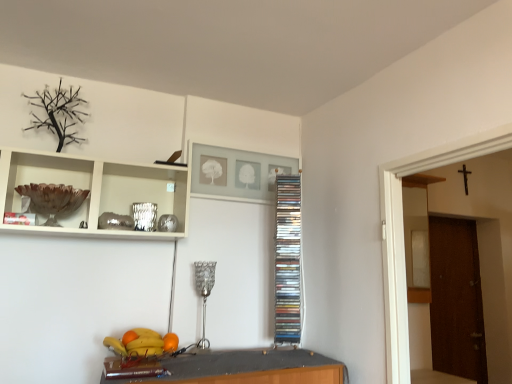
The width and height of the screenshot is (512, 384). I want to click on orange matte at lower center, the first orange positioned from the right, so click(x=170, y=342).

Identify the location of clear plastic cd rack at center, marked as the second cabinet in a left-to-right arrangement. (288, 260).

Where is `silver metallic lamp at center`? The height and width of the screenshot is (384, 512). silver metallic lamp at center is located at coordinates (204, 292).

Does point (446, 365) lie behind point (205, 297)?

Yes, it is.

From the image's perspective, which is above, brown textured door at right or silver metallic lamp at center?

silver metallic lamp at center, from the image's perspective.

Is brown textured door at right facing away from silver metallic lamp at center?

No, silver metallic lamp at center is not at the back of brown textured door at right.

Is clear plastic cd rack at center, which is the first cabinet from back to front, placed right next to brown textured door at right?

No.

From a real-world perspective, who is located lower, clear plastic cd rack at center, which is the first cabinet from back to front, or brown textured door at right?

brown textured door at right is physically lower.

From the image's perspective, which one is positioned higher, clear plastic cd rack at center, marked as the second cabinet in a left-to-right arrangement, or brown textured door at right?

From the image's view, clear plastic cd rack at center, marked as the second cabinet in a left-to-right arrangement, is above.

Considering the relative sizes of orange matte at lower center, marked as the first orange in a left-to-right arrangement, and orange matte at lower center, the second orange in the left-to-right sequence, in the image provided, is orange matte at lower center, marked as the first orange in a left-to-right arrangement, taller than orange matte at lower center, the second orange in the left-to-right sequence,?

Incorrect, the height of orange matte at lower center, marked as the first orange in a left-to-right arrangement, is not larger of that of orange matte at lower center, the second orange in the left-to-right sequence.

Identify the location of orange behind the orange matte at lower center, marked as the first orange in a left-to-right arrangement. (170, 342).

Is orange matte at lower center, marked as the first orange in a left-to-right arrangement, next to orange matte at lower center, the second orange in the left-to-right sequence, and touching it?

orange matte at lower center, marked as the first orange in a left-to-right arrangement, and orange matte at lower center, the second orange in the left-to-right sequence, are clearly separated.

From the picture: From the image's perspective, is orange matte at lower center, arranged as the 2th orange when viewed from the right, located above orange matte at lower center, the first orange positioned from the right?

Yes, from the image's perspective, orange matte at lower center, arranged as the 2th orange when viewed from the right, is on top of orange matte at lower center, the first orange positioned from the right.

Is clear plastic cd rack at center, which is the first cabinet from back to front, at the back of shiny plastic bowl at lower center?

No.

In the image, is shiny plastic bowl at lower center on the left side or the right side of clear plastic cd rack at center, marked as the second cabinet in a left-to-right arrangement?

Clearly, shiny plastic bowl at lower center is on the left of clear plastic cd rack at center, marked as the second cabinet in a left-to-right arrangement, in the image.

Measure the distance between shiny plastic bowl at lower center and clear plastic cd rack at center, positioned as the 2th cabinet in front-to-back order.

shiny plastic bowl at lower center and clear plastic cd rack at center, positioned as the 2th cabinet in front-to-back order, are 71.64 centimeters apart.

Locate an element on the screen. This screenshot has width=512, height=384. door located behind the orange matte at lower center, arranged as the 2th orange when viewed from the right is located at coordinates (456, 300).

Can you confirm if orange matte at lower center, marked as the first orange in a left-to-right arrangement, is wider than brown textured door at right?

In fact, orange matte at lower center, marked as the first orange in a left-to-right arrangement, might be narrower than brown textured door at right.

Is orange matte at lower center, arranged as the 2th orange when viewed from the right, bigger than brown textured door at right?

No, orange matte at lower center, arranged as the 2th orange when viewed from the right, is not bigger than brown textured door at right.

From a real-world perspective, is orange matte at lower center, arranged as the 2th orange when viewed from the right, located beneath brown textured door at right?

Yes, from a real-world perspective, orange matte at lower center, arranged as the 2th orange when viewed from the right, is under brown textured door at right.

Where is `the 2nd orange located beneath the silver metallic lamp at center (from a real-world perspective)`? the 2nd orange located beneath the silver metallic lamp at center (from a real-world perspective) is located at coordinates [170, 342].

From the image's perspective, is orange matte at lower center, the first orange positioned from the right, located above silver metallic lamp at center?

No, from the image's perspective, orange matte at lower center, the first orange positioned from the right, is not on top of silver metallic lamp at center.

From a real-world perspective, is orange matte at lower center, the first orange positioned from the right, located beneath silver metallic lamp at center?

Indeed, from a real-world perspective, orange matte at lower center, the first orange positioned from the right, is positioned beneath silver metallic lamp at center.

Is point (175, 336) closer to camera compared to point (205, 276)?

Yes, point (175, 336) is closer to viewer.

Is silver metallic lamp at center oriented away from shiny plastic bowl at lower center?

That's not correct — silver metallic lamp at center is not looking away from shiny plastic bowl at lower center.

Would you say silver metallic lamp at center contains shiny plastic bowl at lower center?

No, shiny plastic bowl at lower center is not inside silver metallic lamp at center.

From the image's perspective, is silver metallic lamp at center over shiny plastic bowl at lower center?

Indeed, from the image's perspective, silver metallic lamp at center is shown above shiny plastic bowl at lower center.

Would you say silver metallic lamp at center is a long distance from shiny plastic bowl at lower center?

silver metallic lamp at center is actually quite close to shiny plastic bowl at lower center.

Locate an element on the screen. door above the silver metallic lamp at center (from a real-world perspective) is located at coordinates (456, 300).

The image size is (512, 384). I want to click on the 1st cabinet above when counting from the brown textured door at right (from the image's perspective), so click(288, 260).

Looking at the image, which one is located further to brown textured door at right, clear plastic cd rack at center, positioned as the 2th cabinet in front-to-back order, or shiny plastic bowl at lower center?

shiny plastic bowl at lower center.

Based on their spatial positions, is brown glass bowl at upper left, the first cabinet when ordered from front to back, or orange matte at lower center, arranged as the 2th orange when viewed from the right, closer to silver metallic lamp at center?

orange matte at lower center, arranged as the 2th orange when viewed from the right.

Looking at the image, which one is located closer to silver metallic lamp at center, brown glass bowl at upper left, the second cabinet when ordered from right to left, or brown textured door at right?

brown glass bowl at upper left, the second cabinet when ordered from right to left, lies closer to silver metallic lamp at center than the other object.

Based on their spatial positions, is shiny plastic bowl at lower center or orange matte at lower center, the second orange in the left-to-right sequence, closer to brown textured door at right?

shiny plastic bowl at lower center is positioned closer to the anchor brown textured door at right.

Estimate the real-world distances between objects in this image. Which object is closer to orange matte at lower center, arranged as the 2th orange when viewed from the right, clear plastic cd rack at center, the first cabinet positioned from the right, or shiny plastic bowl at lower center?

The object closer to orange matte at lower center, arranged as the 2th orange when viewed from the right, is shiny plastic bowl at lower center.

When comparing their distances from shiny plastic bowl at lower center, does brown glass bowl at upper left, positioned as the 2th cabinet in back-to-front order, or orange matte at lower center, arranged as the 2th orange when viewed from the right, seem further?

Based on the image, brown glass bowl at upper left, positioned as the 2th cabinet in back-to-front order, appears to be further to shiny plastic bowl at lower center.

Based on their spatial positions, is orange matte at lower center, the second orange in the left-to-right sequence, or clear plastic cd rack at center, the first cabinet positioned from the right, further from brown textured door at right?

orange matte at lower center, the second orange in the left-to-right sequence.

Looking at the image, which one is located closer to orange matte at lower center, the second orange in the left-to-right sequence, brown glass bowl at upper left, the first cabinet from the left, or silver metallic lamp at center?

silver metallic lamp at center.

Where is `lamp between brown glass bowl at upper left, positioned as the 2th cabinet in back-to-front order, and clear plastic cd rack at center, marked as the second cabinet in a left-to-right arrangement, in the horizontal direction`? lamp between brown glass bowl at upper left, positioned as the 2th cabinet in back-to-front order, and clear plastic cd rack at center, marked as the second cabinet in a left-to-right arrangement, in the horizontal direction is located at coordinates [204, 292].

Where is `fruit located between orange matte at lower center, marked as the first orange in a left-to-right arrangement, and brown textured door at right in the left-right direction`? The image size is (512, 384). fruit located between orange matte at lower center, marked as the first orange in a left-to-right arrangement, and brown textured door at right in the left-right direction is located at coordinates (142, 343).

Locate an element on the screen. orange between shiny plastic bowl at lower center and clear plastic cd rack at center, marked as the second cabinet in a left-to-right arrangement, in the horizontal direction is located at coordinates (170, 342).

At what (x,y) coordinates should I click in order to perform the action: click on cabinet between silver metallic lamp at center and brown textured door at right in the horizontal direction. Please return your answer as a coordinate pair (x, y). Looking at the image, I should click on (288, 260).